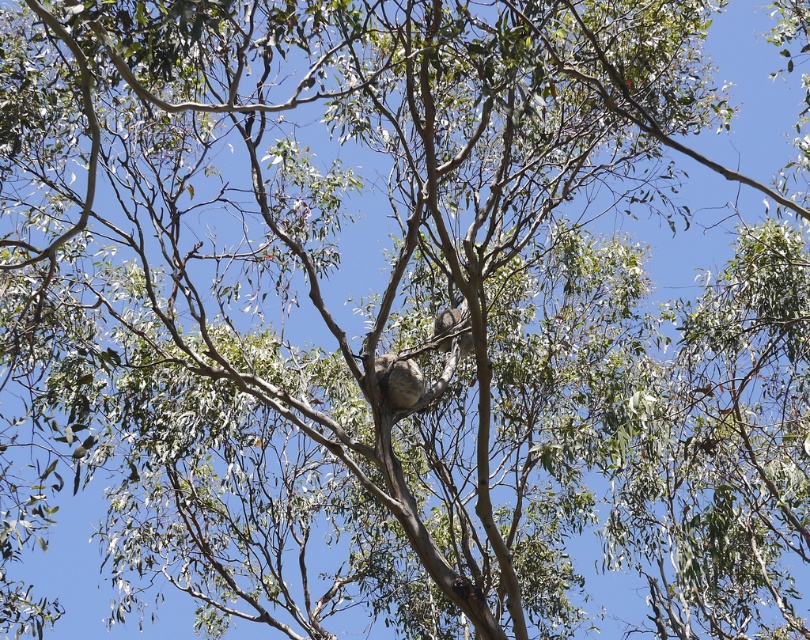
In the image of the eucalyptus tree, there are two koalas visible. One is a fuzzy brown koala at center and the other is a fuzzy gray koala at center. Which koala is positioned higher up on the tree?

The fuzzy gray koala at center is positioned higher up on the tree than the fuzzy brown koala at center.

You are observing a eucalyptus tree with two koalas. You notice a fuzzy brown koala at center and a fuzzy gray koala at center. Which koala is located more to the left?

The fuzzy brown koala at center is more to the left than the fuzzy gray koala at center.